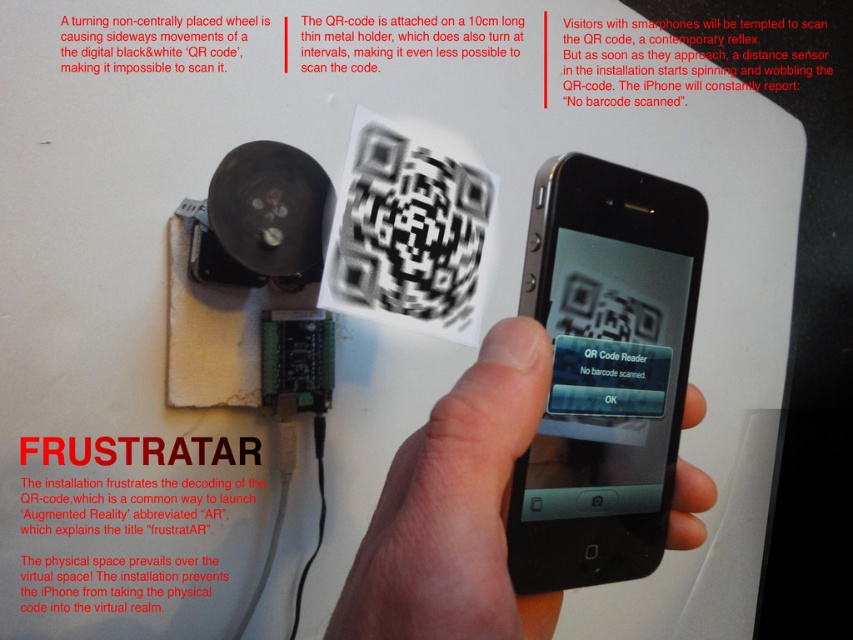
You are an engineer trying to align your black matte smartphone at center with the QR code in the installation. Based on the coordinates provided, can you estimate the direction you need to move your smartphone to align with the QR code?

The black matte smartphone at center is located at coordinates point (604, 371). To align with the QR code, you would need to move it towards the direction where the QR code is positioned, but since the exact coordinates of the QR code aren

You are holding a smartphone and trying to scan the QR code in the image. The QR code is located at point (592, 205). Your smartphone requires the QR code to be at least 16 inches away to focus properly. Can you scan the QR code from your current position?

The point (592, 205) is 14.94 inches away from the viewer. Since this distance is less than the required 16 inches for proper focus, you cannot scan the QR code from your current position.

You are holding a black matte smartphone at center and want to scan the QR code. The skinsmoothhand at center is holding the smartphone. Since the smartphone is much taller than the hand, can you adjust the angle to scan the QR code properly?

The black matte smartphone at center is much taller than the skinsmoothhand at center, so adjusting the angle might be challenging due to the smartphone being too large for the hand to maneuver easily. This could make it difficult to scan the QR code properly.